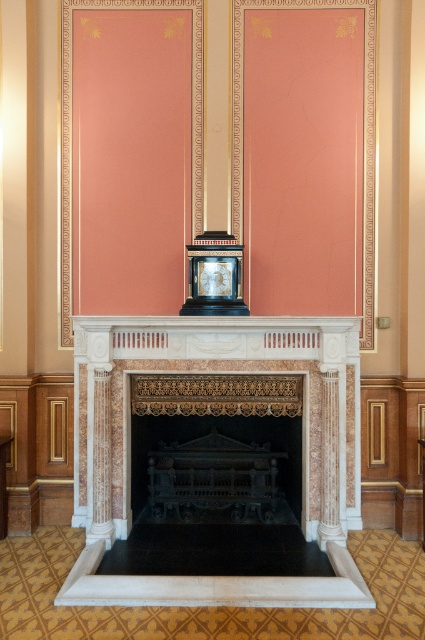
Measure the distance between point (x=334, y=464) and camera.

Point (x=334, y=464) is 4.69 meters away from camera.

Between point (325, 492) and point (203, 276), which one is positioned in front?

Point (325, 492) is in front.

Is point (125, 353) positioned behind point (206, 264)?

That is False.

The width and height of the screenshot is (425, 640). Identify the location of marble fireplace at center. (130, 452).

Consider the image. Does black marble fireplace at center have a lesser height compared to matte black clock at center?

No.

Does black marble fireplace at center appear over matte black clock at center?

No, black marble fireplace at center is not above matte black clock at center.

Is point (248, 440) less distant than point (221, 292)?

No, (248, 440) is further to viewer.

I want to click on black marble fireplace at center, so pos(204,433).

Does marble fireplace at center appear over black marble fireplace at center?

Yes, marble fireplace at center is above black marble fireplace at center.

Is marble fireplace at center below black marble fireplace at center?

Incorrect, marble fireplace at center is not positioned below black marble fireplace at center.

Is point (206, 586) behind point (147, 419)?

No, it is not.

Find the location of a particular element. The image size is (425, 640). marble fireplace at center is located at coordinates (130, 452).